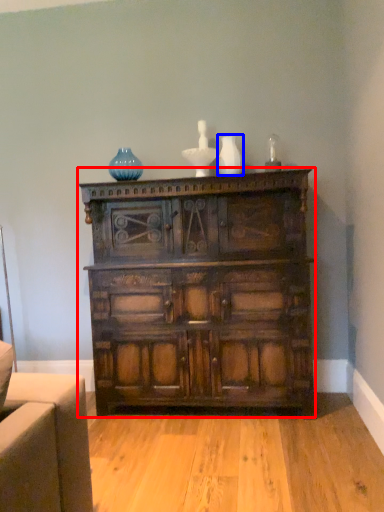
Question: Which object is further to the camera taking this photo, chest of drawers (highlighted by a red box) or vase (highlighted by a blue box)?

Choices:
 (A) chest of drawers
 (B) vase

Answer: (B)